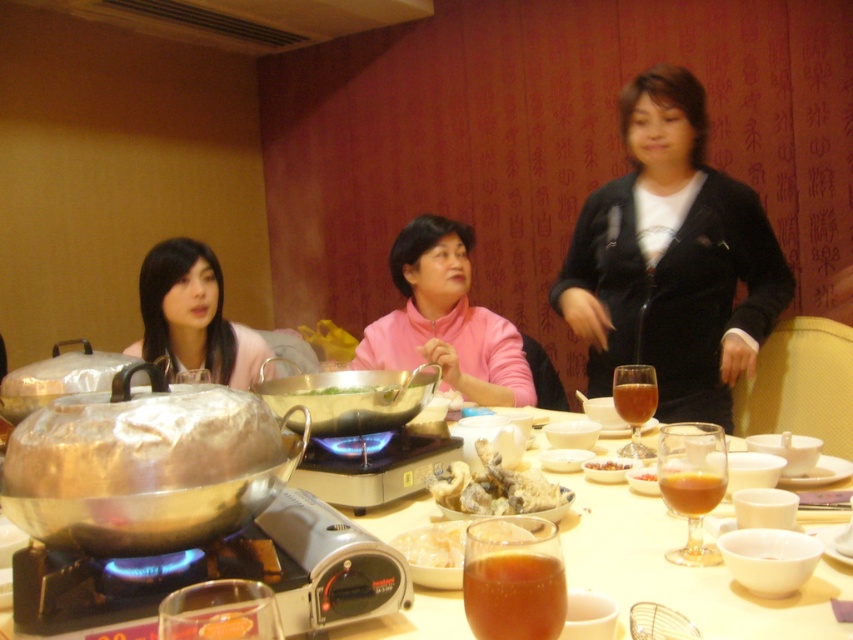
Question: Is the position of matte pink sweater at left less distant than that of green leafy vegetables at center?

Choices:
 (A) yes
 (B) no

Answer: (B)

Question: Among these objects, which one is farthest from the camera?

Choices:
 (A) translucent white noodles at center
 (B) golden crispy chicken at center
 (C) black velvet jacket at upper right

Answer: (C)

Question: Does metallic silver pot at center have a larger size compared to golden crispy chicken at center?

Choices:
 (A) yes
 (B) no

Answer: (A)

Question: Which point is farther from the camera taking this photo?

Choices:
 (A) (479, 481)
 (B) (177, 362)

Answer: (B)

Question: Is black velvet jacket at upper right smaller than green leafy vegetables at center?

Choices:
 (A) yes
 (B) no

Answer: (B)

Question: Among these objects, which one is nearest to the camera?

Choices:
 (A) pink fleece at center
 (B) matte pink sweater at left

Answer: (B)